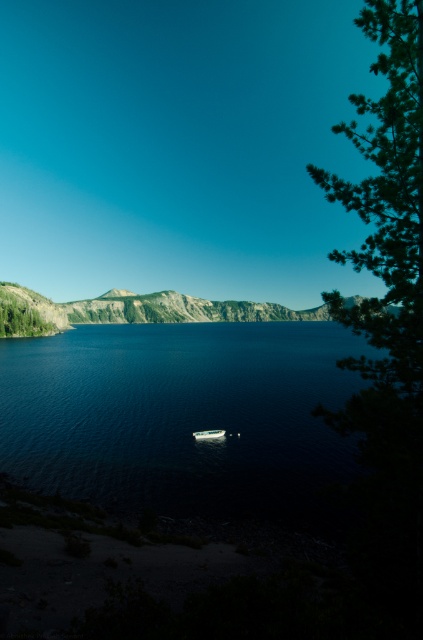
You are an artist planning to paint the lakeside scene. You have two canvas sizes available. One is small and the other is large. You want to paint both the deep blue water at center and the green leafy tree at right. Which object should you paint on the large canvas to accurately represent their relative sizes as seen in the image?

The green leafy tree at right should be painted on the large canvas because it is larger than the deep blue water at center in the image.

You are standing at the lakeside and want to reach the point marked at coordinates point (x=107, y=376). The distance between you and that point is 95.40 meters. If you walk at a speed of 1.5 meters per second, how many minutes will it take you to reach the point?

The distance between you and the point (x=107, y=376) is 95.40 meters. At a walking speed of 1.5 meters per second, it will take 63.6 seconds, which is approximately 1.06 minutes. Therefore, it will take about 1.06 minutes to reach the point.

You are standing on the lakeside shore and want to take a photo of both the deep blue water at center and the green leafy tree at right. Which object should you focus on first to ensure it appears in focus in your photo?

The deep blue water at center should be focused on first because it is closer to you than the green leafy tree at right, which is further away.